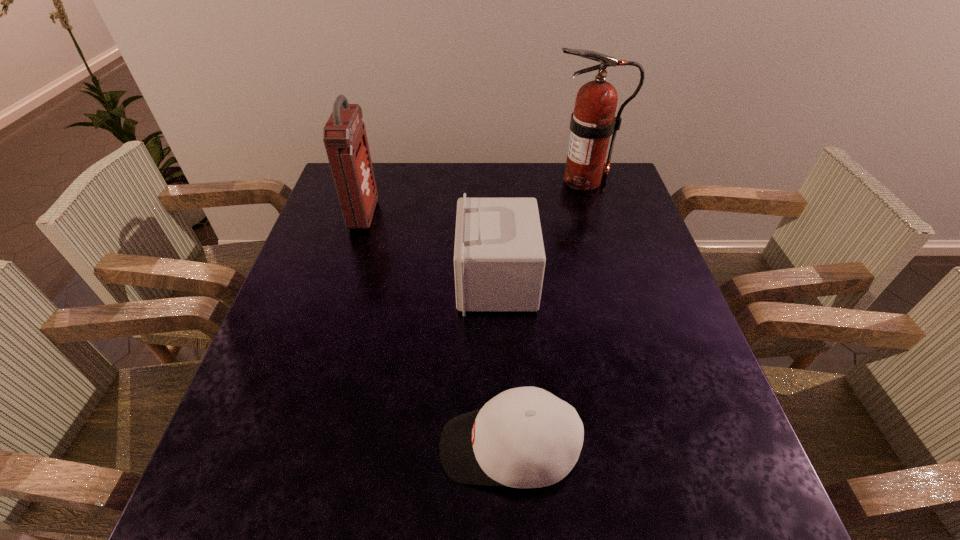
The width and height of the screenshot is (960, 540). In order to click on free space between the shortest object and the leftmost object in this screenshot , I will do `click(436, 331)`.

You are a GUI agent. You are given a task and a screenshot of the screen. Output one action in this format:
    pyautogui.click(x=<x>, y=<y>)
    Task: Click on the vacant area that lies between the leftmost object and the third tallest object
    The height and width of the screenshot is (540, 960).
    Given the screenshot: What is the action you would take?
    pyautogui.click(x=430, y=248)

The width and height of the screenshot is (960, 540). Identify the location of vacant area between the fire extinguisher and the nearest object. (546, 314).

In order to click on vacant area between the right first-aid kit and the second tallest object in this screenshot , I will do `click(430, 248)`.

Where is `empty space that is in between the nearest object and the second tallest object`? empty space that is in between the nearest object and the second tallest object is located at coordinates (436, 331).

Where is `vacant point located between the second farthest object and the shorter first-aid kit`? vacant point located between the second farthest object and the shorter first-aid kit is located at coordinates (430, 248).

Where is `free space between the nearest object and the third farthest object`? free space between the nearest object and the third farthest object is located at coordinates (503, 364).

Locate which object is the closest to the shorter first-aid kit. Please provide its 2D coordinates. Your answer should be formatted as a tuple, i.e. [(x, y)], where the tuple contains the x and y coordinates of a point satisfying the conditions above.

[(525, 437)]

I want to click on the closest object to the farthest object, so click(x=499, y=259).